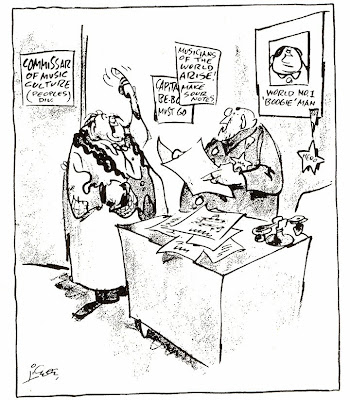
Locate an element on the screen. door is located at coordinates (56, 132).